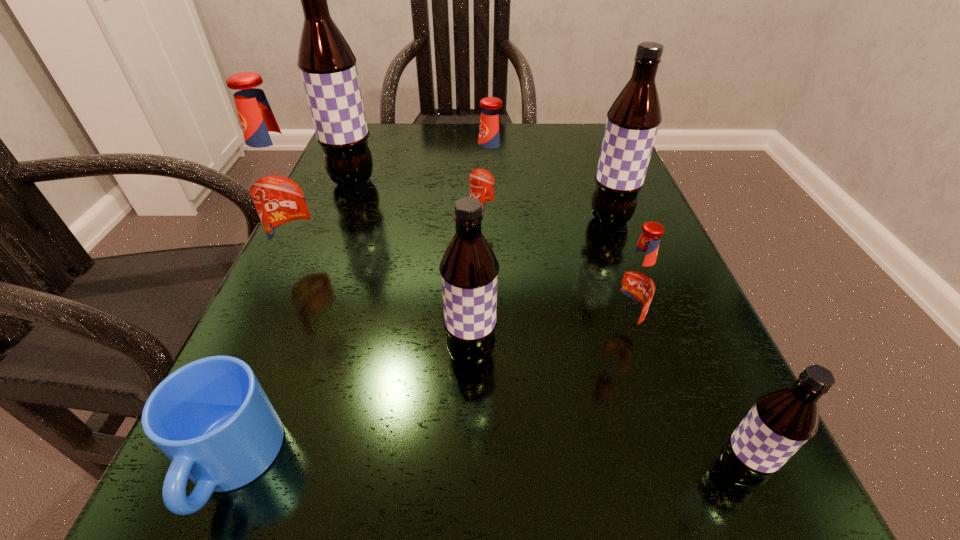
The width and height of the screenshot is (960, 540). In order to click on vacant space at the left edge of the desktop in this screenshot , I will do `click(315, 326)`.

Where is `vacant space at the right edge of the desktop`? Image resolution: width=960 pixels, height=540 pixels. vacant space at the right edge of the desktop is located at coordinates (618, 269).

Locate an element on the screen. free space at the far left corner is located at coordinates (396, 130).

At what (x,y) coordinates should I click in order to perform the action: click on vacant space at the near left corner of the desktop. Please return your answer as a coordinate pair (x, y). This screenshot has height=540, width=960. Looking at the image, I should click on (324, 496).

In the image, there is a desktop. Find the location of `vacant space at the far right corner`. vacant space at the far right corner is located at coordinates (547, 130).

Where is `vacant space that's between the biggest brown root beer and the mug`? Image resolution: width=960 pixels, height=540 pixels. vacant space that's between the biggest brown root beer and the mug is located at coordinates (292, 322).

Find the location of a particular element. This screenshot has height=540, width=960. free space between the nearest brown root beer and the shortest object is located at coordinates (484, 468).

You are a GUI agent. You are given a task and a screenshot of the screen. Output one action in this format:
    pyautogui.click(x=<x>, y=<y>)
    Task: Click on the empty location between the biggest red root beer and the third brown root beer from right to left
    The height and width of the screenshot is (540, 960).
    Given the screenshot: What is the action you would take?
    pyautogui.click(x=389, y=308)

The width and height of the screenshot is (960, 540). Find the location of `vacant region between the mug and the third smallest brown root beer`. vacant region between the mug and the third smallest brown root beer is located at coordinates (420, 341).

At what (x,y) coordinates should I click in order to perform the action: click on free point between the second nearest red root beer and the nearest root beer. Please return your answer as a coordinate pair (x, y). The width and height of the screenshot is (960, 540). Looking at the image, I should click on (521, 367).